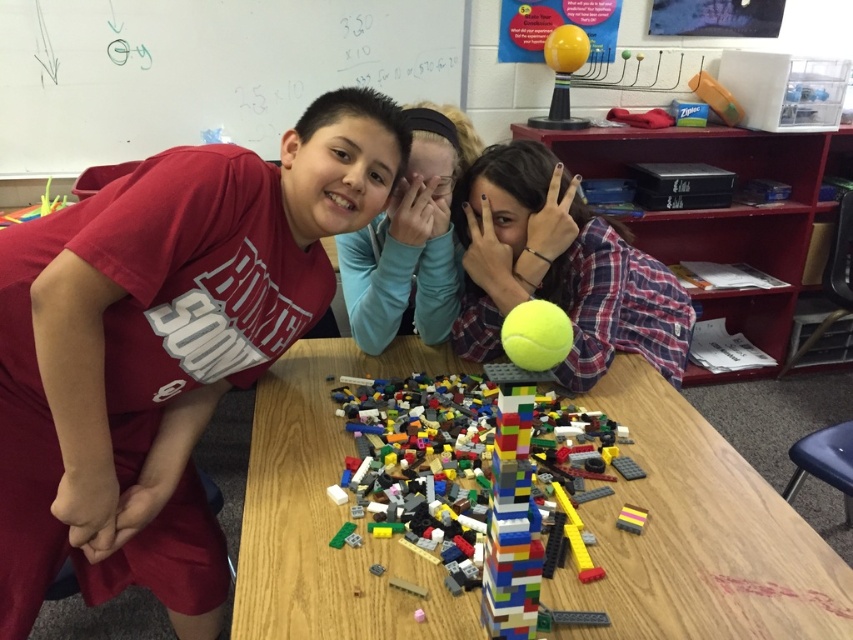
From the picture: Is matte red shirt at left positioned in front of multicolored plastic blocks at center?

No.

Which is behind, point (306, 308) or point (527, 376)?

Positioned behind is point (306, 308).

Locate an element on the screen. The width and height of the screenshot is (853, 640). matte red shirt at left is located at coordinates (161, 348).

Image resolution: width=853 pixels, height=640 pixels. What are the coordinates of `matte red shirt at left` in the screenshot? It's located at (161, 348).

Does point (125, 349) come in front of point (317, 545)?

No, (125, 349) is behind (317, 545).

What do you see at coordinates (161, 348) in the screenshot? The width and height of the screenshot is (853, 640). I see `matte red shirt at left` at bounding box center [161, 348].

The width and height of the screenshot is (853, 640). Identify the location of matte red shirt at left. (161, 348).

Can you confirm if multicolored plastic blocks at center is positioned to the right of matte red shirt at upper left?

Indeed, multicolored plastic blocks at center is positioned on the right side of matte red shirt at upper left.

Who is higher up, multicolored plastic blocks at center or matte red shirt at upper left?

Positioned higher is matte red shirt at upper left.

Is point (550, 564) closer to viewer compared to point (366, 257)?

That is True.

What are the coordinates of `multicolored plastic blocks at center` in the screenshot? It's located at (492, 500).